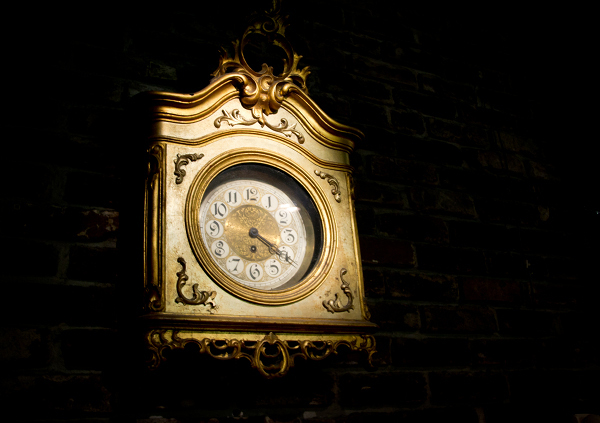
This screenshot has height=423, width=600. What are the coordinates of `clock on wall` in the screenshot? It's located at (343, 213).